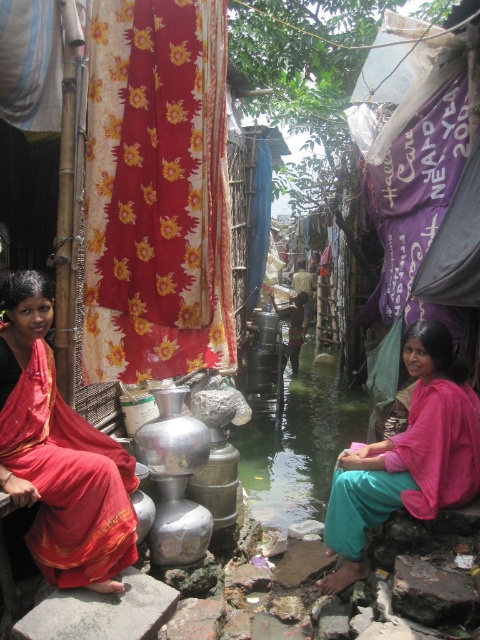
Question: Which is farther from the matte red sari at left?

Choices:
 (A) pink fabric at lower right
 (B) floral fabric curtain at upper left

Answer: (A)

Question: Can you confirm if floral fabric curtain at upper left is positioned below pink fabric at lower right?

Choices:
 (A) no
 (B) yes

Answer: (A)

Question: Is floral fabric curtain at upper left bigger than pink fabric at lower right?

Choices:
 (A) no
 (B) yes

Answer: (A)

Question: In this image, where is floral fabric curtain at upper left located relative to matte red sari at left?

Choices:
 (A) above
 (B) below

Answer: (A)

Question: Which of the following is the closest to the observer?

Choices:
 (A) pink fabric at lower right
 (B) matte red sari at left

Answer: (B)

Question: Among these objects, which one is farthest from the camera?

Choices:
 (A) floral fabric curtain at upper left
 (B) pink fabric at lower right

Answer: (B)